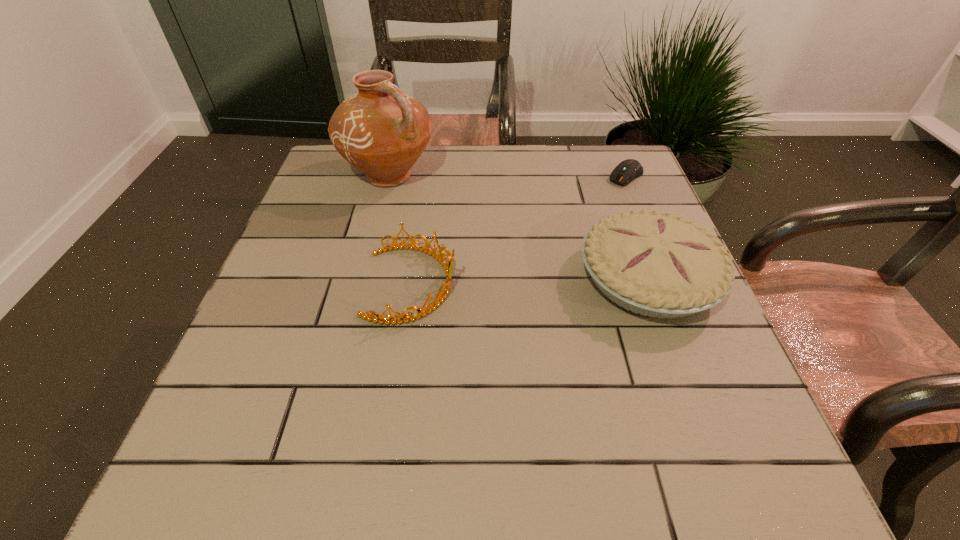
This screenshot has width=960, height=540. What are the coordinates of `free space on the desktop that is between the tiara and the pie and is positioned on the button of the computer equipment` in the screenshot? It's located at (503, 282).

What are the coordinates of `vacant space on the desktop that is between the tiara and the pie and is positioned on the side of the pottery with the handle` in the screenshot? It's located at (x=525, y=281).